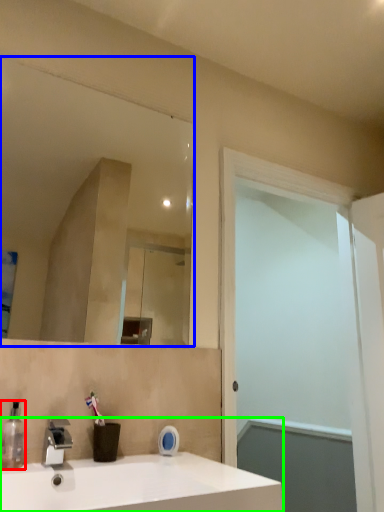
Question: Based on their relative distances, which object is farther from soap dispenser (highlighted by a red box)? Choose from mirror (highlighted by a blue box) and sink (highlighted by a green box).

Choices:
 (A) mirror
 (B) sink

Answer: (A)